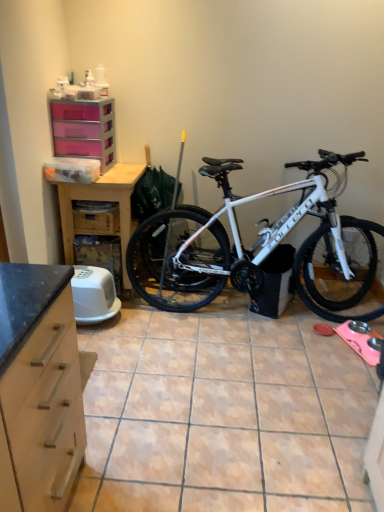
Question: Is white matte bicycle at center to the left or to the right of pink plastic drawers at upper left in the image?

Choices:
 (A) left
 (B) right

Answer: (B)

Question: Is white matte bicycle at center bigger or smaller than pink plastic drawers at upper left?

Choices:
 (A) big
 (B) small

Answer: (A)

Question: Which is nearer to the pink plastic drawers at upper left?

Choices:
 (A) brown cardboard crate at lower left
 (B) wooden table at left
 (C) porcelain tile at center
 (D) white matte bicycle at center

Answer: (B)

Question: Which object is the closest to the brown cardboard crate at lower left?

Choices:
 (A) pink plastic drawers at upper left
 (B) porcelain tile at center
 (C) wooden table at left
 (D) white matte bicycle at center

Answer: (C)